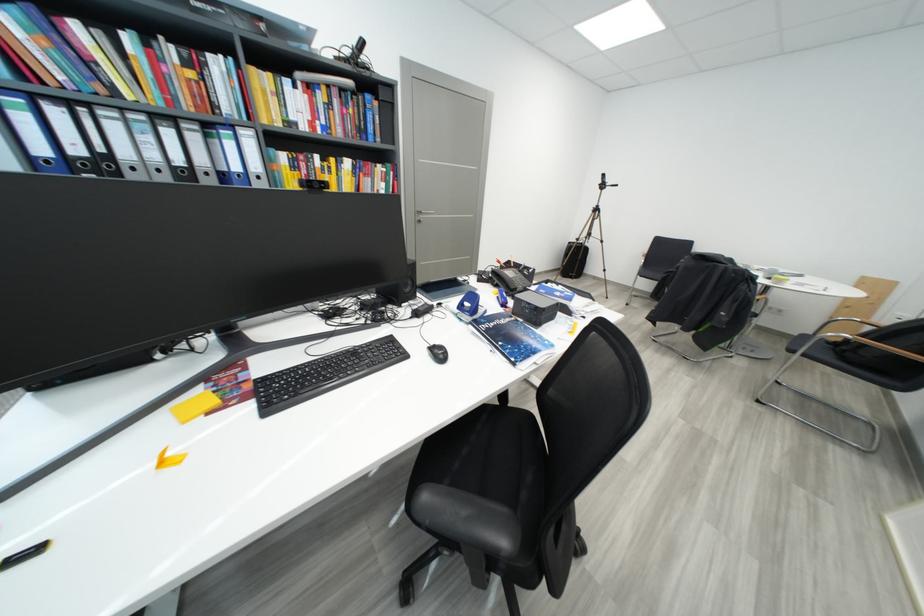
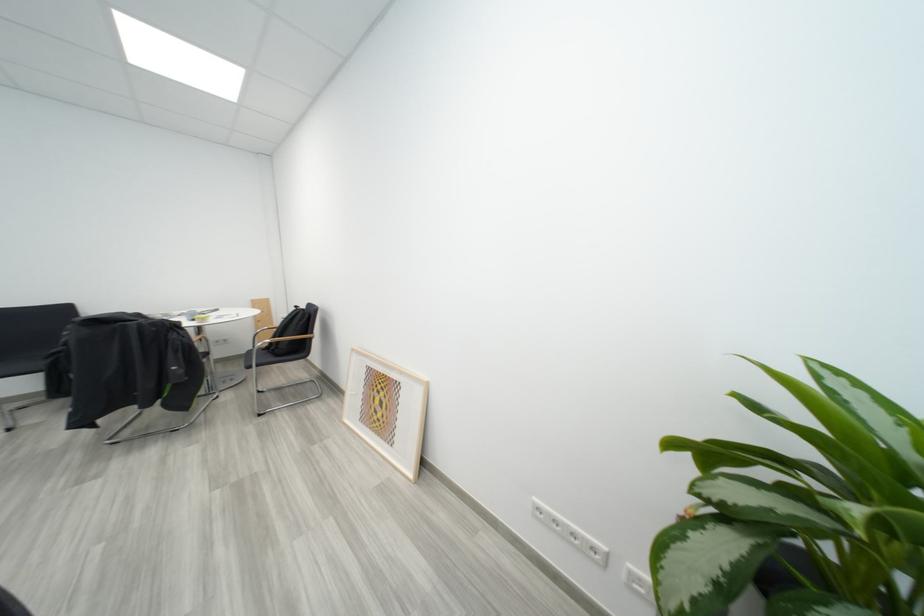
The first image is from the beginning of the video and the second image is from the end. How did the camera likely rotate when shooting the video?

The camera rotated toward right-down.